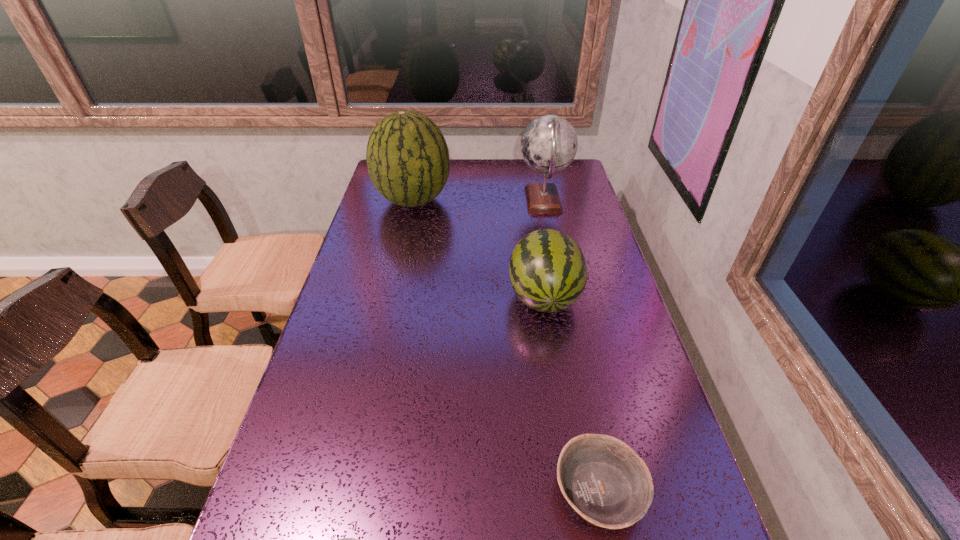
Locate an element on the screen. The height and width of the screenshot is (540, 960). globe is located at coordinates (549, 143).

Identify the location of the farther watermelon. Image resolution: width=960 pixels, height=540 pixels. (407, 156).

This screenshot has height=540, width=960. Find the location of `the left watermelon`. the left watermelon is located at coordinates (407, 156).

Identify the location of the right watermelon. (548, 272).

The width and height of the screenshot is (960, 540). Find the location of `the third shortest object`. the third shortest object is located at coordinates (x=548, y=272).

Where is `vacant space located at the equator of the globe`? The image size is (960, 540). vacant space located at the equator of the globe is located at coordinates (430, 201).

Where is `free space located 0.330m at the equator of the globe`? The width and height of the screenshot is (960, 540). free space located 0.330m at the equator of the globe is located at coordinates (430, 201).

Where is `vacant space located at the equator of the globe`? The width and height of the screenshot is (960, 540). vacant space located at the equator of the globe is located at coordinates (415, 201).

Where is `vacant space located 0.170m on the right of the taller watermelon`? The image size is (960, 540). vacant space located 0.170m on the right of the taller watermelon is located at coordinates (496, 200).

Where is `vacant space located at the stem end of the third farthest object`? The image size is (960, 540). vacant space located at the stem end of the third farthest object is located at coordinates (558, 382).